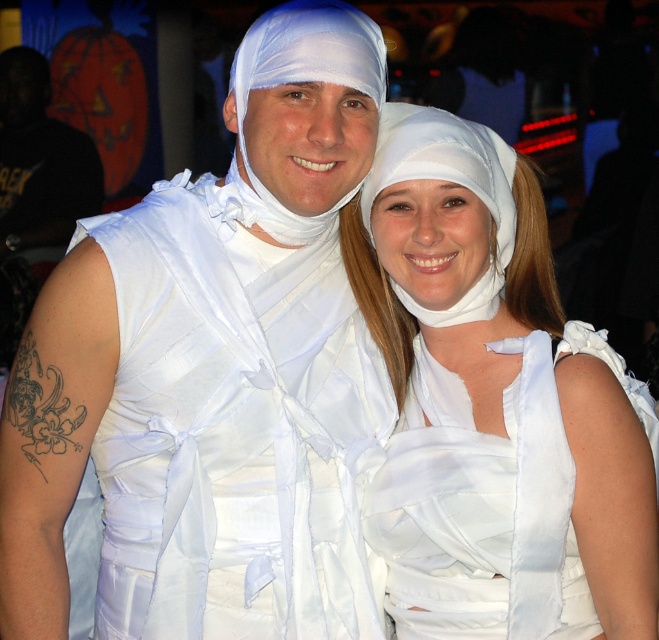
Question: Which point appears closest to the camera in this image?

Choices:
 (A) (453, 145)
 (B) (169, 259)

Answer: (B)

Question: Does white satin dress at center appear over white satin/crepe dress at center?

Choices:
 (A) yes
 (B) no

Answer: (A)

Question: Which object is closer to the camera taking this photo?

Choices:
 (A) white satin dress at center
 (B) white satin/crepe dress at center

Answer: (A)

Question: Is white satin dress at center further to the viewer compared to white satin/crepe dress at center?

Choices:
 (A) no
 (B) yes

Answer: (A)

Question: Is white satin dress at center above white satin/crepe dress at center?

Choices:
 (A) yes
 (B) no

Answer: (A)

Question: Which object is farther from the camera taking this photo?

Choices:
 (A) white satin/crepe dress at center
 (B) white satin dress at center

Answer: (A)